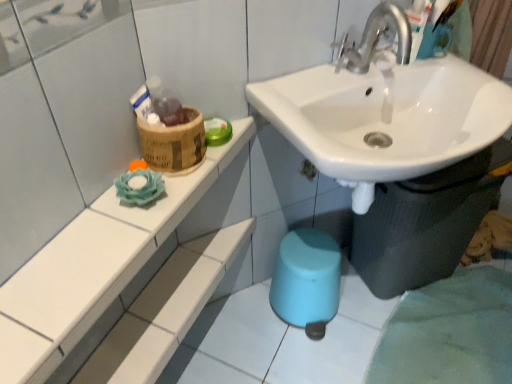
Question: From a real-world perspective, is white ceramic shelf at upper left beneath white glossy sink at center?

Choices:
 (A) yes
 (B) no

Answer: (B)

Question: Is white ceramic shelf at upper left facing towards white glossy sink at center?

Choices:
 (A) no
 (B) yes

Answer: (A)

Question: Would you consider white ceramic shelf at upper left to be distant from white glossy sink at center?

Choices:
 (A) no
 (B) yes

Answer: (A)

Question: Is white ceramic shelf at upper left touching white glossy sink at center?

Choices:
 (A) no
 (B) yes

Answer: (A)

Question: Is white ceramic shelf at upper left oriented away from white glossy sink at center?

Choices:
 (A) no
 (B) yes

Answer: (A)

Question: In the image, is white ceramic shelf at upper left positioned in front of or behind white glossy sink at center?

Choices:
 (A) front
 (B) behind

Answer: (A)

Question: From the image's perspective, is white ceramic shelf at upper left located above or below white glossy sink at center?

Choices:
 (A) below
 (B) above

Answer: (A)

Question: In terms of height, does white ceramic shelf at upper left look taller or shorter compared to white glossy sink at center?

Choices:
 (A) short
 (B) tall

Answer: (A)

Question: In terms of width, does white ceramic shelf at upper left look wider or thinner when compared to white glossy sink at center?

Choices:
 (A) thin
 (B) wide

Answer: (A)

Question: In terms of height, does bamboo basket at upper left look taller or shorter compared to white ceramic shelf at upper left?

Choices:
 (A) tall
 (B) short

Answer: (A)

Question: Is bamboo basket at upper left spatially inside white ceramic shelf at upper left, or outside of it?

Choices:
 (A) outside
 (B) inside

Answer: (A)

Question: In the image, is bamboo basket at upper left on the left side or the right side of white ceramic shelf at upper left?

Choices:
 (A) left
 (B) right

Answer: (B)

Question: Looking at the image, does bamboo basket at upper left seem bigger or smaller compared to white ceramic shelf at upper left?

Choices:
 (A) small
 (B) big

Answer: (A)

Question: From a real-world perspective, is white glossy sink at center above or below white ceramic shelf at upper left?

Choices:
 (A) below
 (B) above

Answer: (A)

Question: From the image's perspective, is white glossy sink at center positioned above or below white ceramic shelf at upper left?

Choices:
 (A) above
 (B) below

Answer: (A)